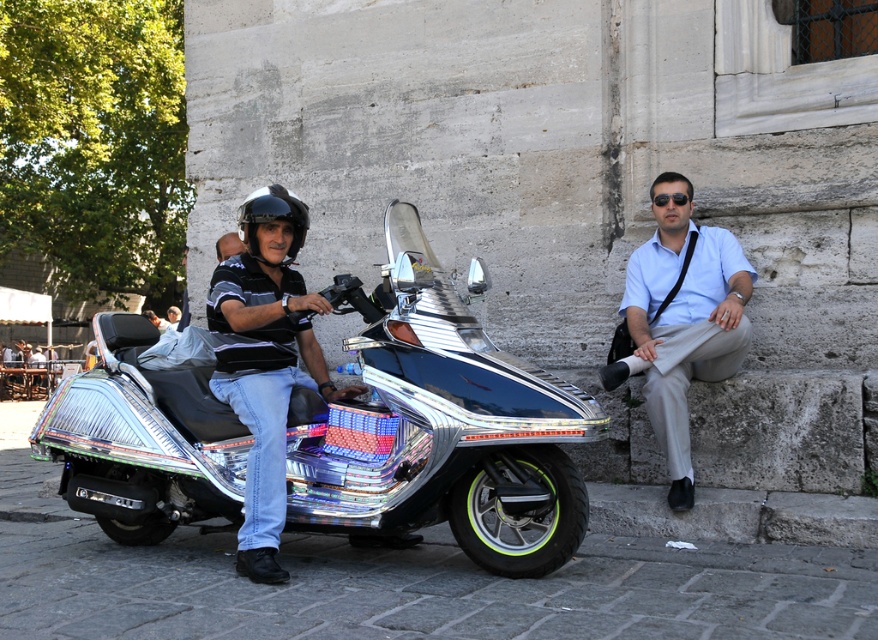
Question: Based on their relative distances, which object is nearer to the shiny chrome scooter at center?

Choices:
 (A) brushed metal water at bottle left
 (B) shiny metallic helmet at upper left
 (C) black matte helmet at center

Answer: (B)

Question: Is shiny chrome scooter at center positioned at the back of black matte helmet at center?

Choices:
 (A) no
 (B) yes

Answer: (A)

Question: Does shiny chrome scooter at center have a greater width compared to light blue shirt at right?

Choices:
 (A) no
 (B) yes

Answer: (B)

Question: Which of the following is the farthest from the observer?

Choices:
 (A) (48, 388)
 (B) (275, 212)
 (C) (171, 378)

Answer: (A)

Question: In this image, where is shiny chrome scooter at center located relative to shiny metallic helmet at upper left?

Choices:
 (A) left
 (B) right

Answer: (A)

Question: Estimate the real-world distances between objects in this image. Which object is closer to the shiny metallic helmet at upper left?

Choices:
 (A) black matte helmet at center
 (B) brushed metal water at bottle left
 (C) shiny chrome scooter at center

Answer: (A)